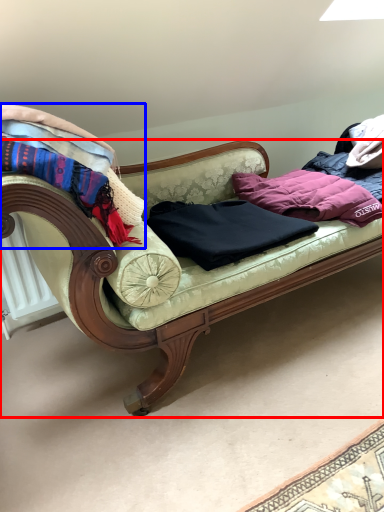
Question: Which object appears farthest to the camera in this image, studio couch (highlighted by a red box) or blanket (highlighted by a blue box)?

Choices:
 (A) studio couch
 (B) blanket

Answer: (B)